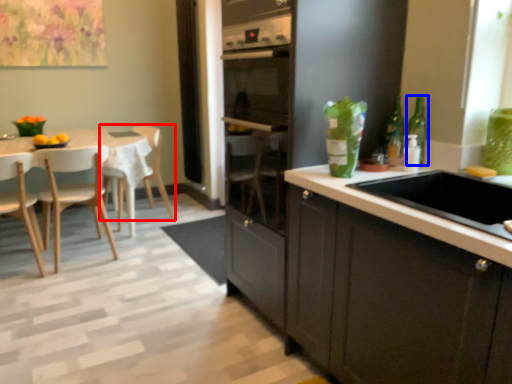
Question: Which object appears farthest to the camera in this image, chair (highlighted by a red box) or bottle (highlighted by a blue box)?

Choices:
 (A) chair
 (B) bottle

Answer: (A)